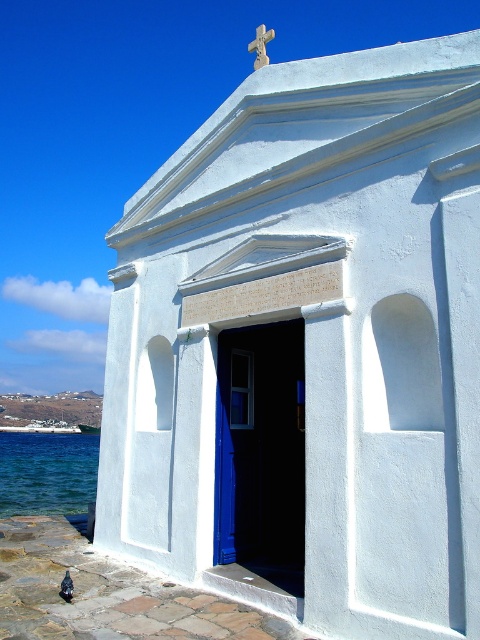
Which of these two, stone textured cross at upper center or black feathered pigeon at lower left, stands shorter?

black feathered pigeon at lower left

Describe the element at coordinates (261, 45) in the screenshot. Image resolution: width=480 pixels, height=640 pixels. I see `stone textured cross at upper center` at that location.

The height and width of the screenshot is (640, 480). Find the location of `stone textured cross at upper center`. stone textured cross at upper center is located at coordinates (261, 45).

Does blue liquid water at lower left appear on the left side of black feathered pigeon at lower left?

Yes, blue liquid water at lower left is to the left of black feathered pigeon at lower left.

You are a GUI agent. You are given a task and a screenshot of the screen. Output one action in this format:
    pyautogui.click(x=<x>, y=<y>)
    Task: Click on the blue liquid water at lower left
    This screenshot has height=640, width=480.
    Given the screenshot: What is the action you would take?
    (47, 472)

Which is behind, point (24, 467) or point (262, 42)?

Point (24, 467)

Does blue liquid water at lower left appear on the left side of stone textured cross at upper center?

Yes, blue liquid water at lower left is to the left of stone textured cross at upper center.

Does point (17, 488) come behind point (255, 58)?

No, it is not.

What are the coordinates of `blue liquid water at lower left` in the screenshot? It's located at (47, 472).